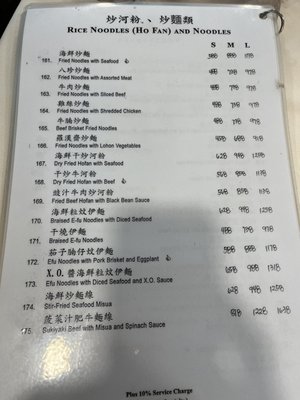
The height and width of the screenshot is (400, 300). What are the coordinates of `laminated menu` in the screenshot? It's located at (203, 348).